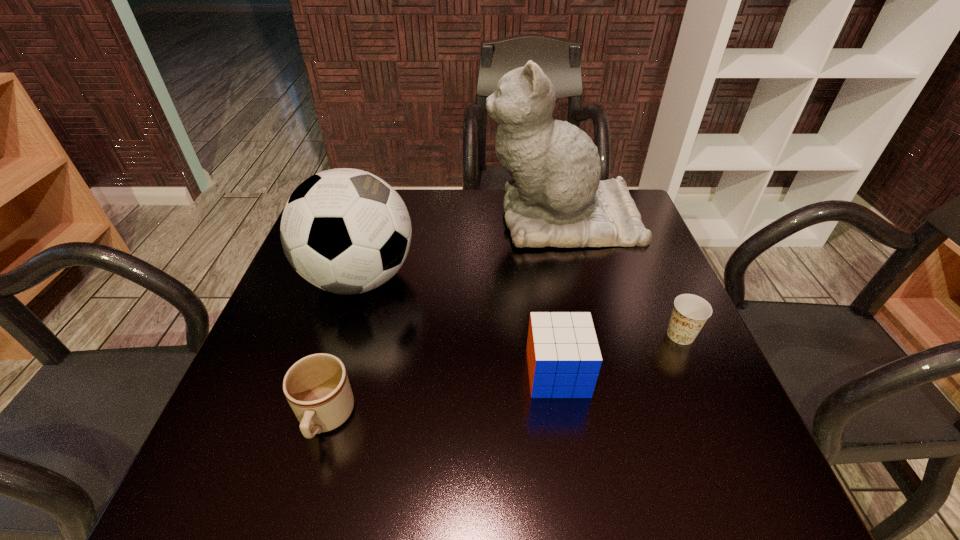
Identify the location of object that is at the far right corner. (555, 197).

Where is `vacant space at the far edge of the desktop`? Image resolution: width=960 pixels, height=540 pixels. vacant space at the far edge of the desktop is located at coordinates (430, 230).

The height and width of the screenshot is (540, 960). I want to click on vacant space at the near edge of the desktop, so click(x=585, y=464).

The height and width of the screenshot is (540, 960). I want to click on vacant position at the left edge of the desktop, so pyautogui.click(x=271, y=316).

This screenshot has width=960, height=540. In the image, there is a desktop. In order to click on vacant space at the right edge in this screenshot , I will do `click(655, 300)`.

In the image, there is a desktop. Identify the location of vacant area at the near left corner. 226,496.

The image size is (960, 540). Find the location of `vacant space at the far right corner of the desktop`. vacant space at the far right corner of the desktop is located at coordinates (629, 189).

At what (x,y) coordinates should I click in order to perform the action: click on vacant space in between the cube and the cat. Please return your answer as a coordinate pair (x, y). The width and height of the screenshot is (960, 540). Looking at the image, I should click on (560, 295).

Where is `vacant point located between the second tallest object and the mug`? vacant point located between the second tallest object and the mug is located at coordinates (343, 348).

The width and height of the screenshot is (960, 540). Identify the location of vacant space that is in between the tallest object and the second tallest object. (461, 248).